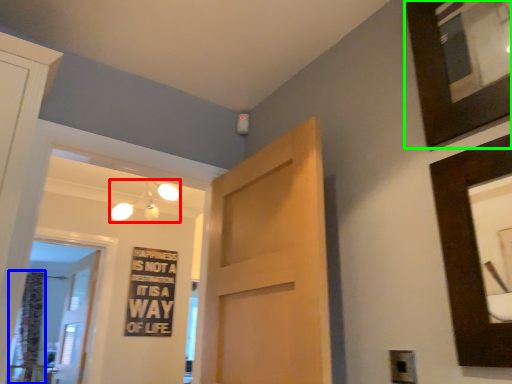
Question: Based on their relative distances, which object is nearer to light fixture (highlighted by a red box)? Choose from curtain (highlighted by a blue box) and picture frame (highlighted by a green box).

Choices:
 (A) curtain
 (B) picture frame

Answer: (A)